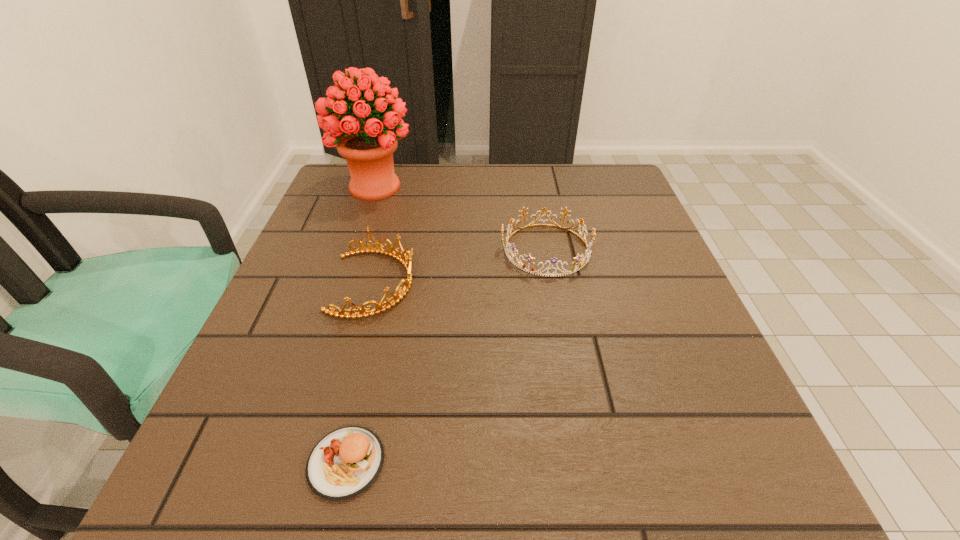
This screenshot has height=540, width=960. Find the location of `vacant space located on the front-facing side of the shorter tiara`. vacant space located on the front-facing side of the shorter tiara is located at coordinates [x=363, y=249].

At what (x,y) coordinates should I click in order to perform the action: click on vacant space located 0.310m on the front-facing side of the shorter tiara. Please return your answer as a coordinate pair (x, y). Image resolution: width=960 pixels, height=540 pixels. Looking at the image, I should click on (358, 249).

You are a GUI agent. You are given a task and a screenshot of the screen. Output one action in this format:
    pyautogui.click(x=<x>, y=<y>)
    Task: Click on the vacant space situated on the front-facing side of the shorter tiara
    
    Given the screenshot: What is the action you would take?
    pyautogui.click(x=348, y=249)

What are the coordinates of `vacant region located 0.190m on the back of the nearest object` in the screenshot? It's located at (376, 330).

I want to click on object at the far edge, so click(368, 147).

Locate an element on the screen. The image size is (960, 540). object located at the near edge is located at coordinates (345, 462).

Identify the location of bouquet located in the left edge section of the desktop. The width and height of the screenshot is (960, 540). (368, 147).

Locate an element on the screen. The image size is (960, 540). tiara that is at the left edge is located at coordinates (398, 296).

The image size is (960, 540). Identify the location of patty located at the left edge. (345, 462).

The width and height of the screenshot is (960, 540). In order to click on object at the right edge in this screenshot , I will do `click(510, 227)`.